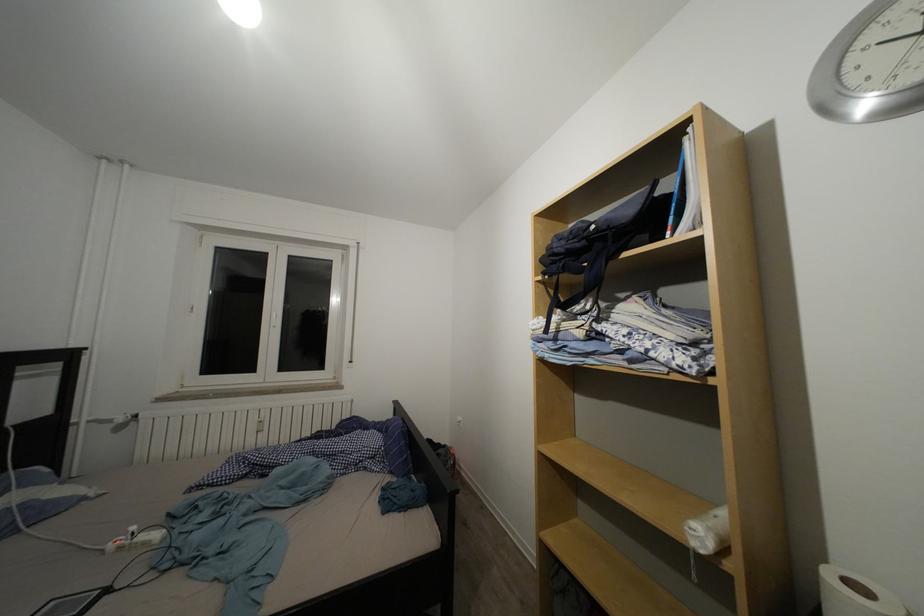
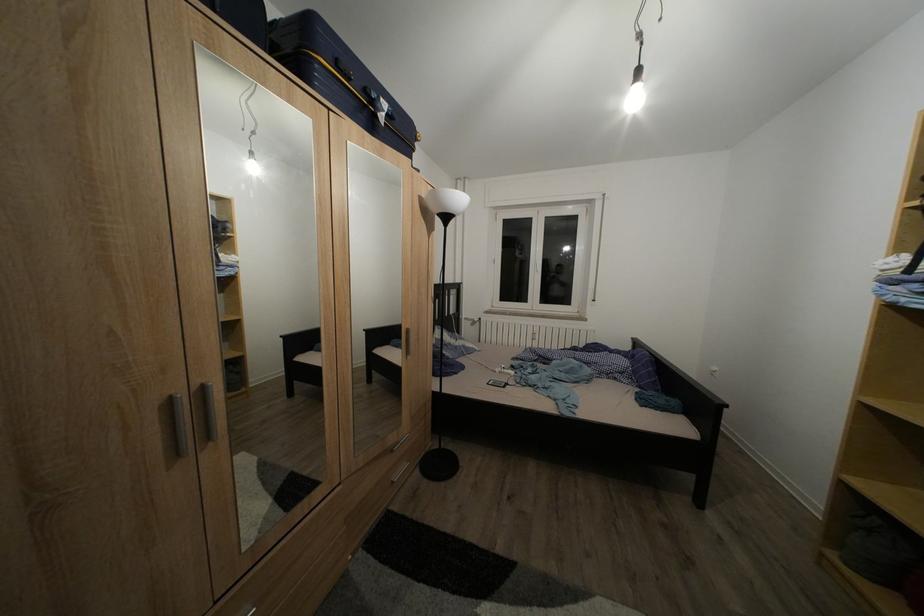
Question: The camera is either moving clockwise (left) or counter-clockwise (right) around the object. The first image is from the beginning of the video and the second image is from the end. Is the camera moving left or right when shooting the video?

Choices:
 (A) Left
 (B) Right

Answer: (B)